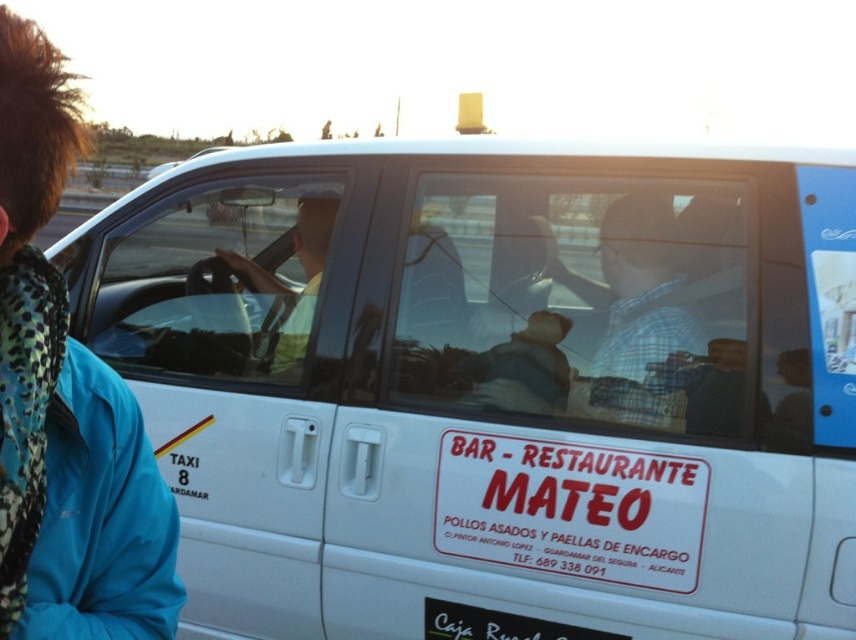
Is white paper sign at center to the right of matte yellow shirt at center from the viewer's perspective?

Yes, white paper sign at center is to the right of matte yellow shirt at center.

Does white paper sign at center appear over matte yellow shirt at center?

Actually, white paper sign at center is below matte yellow shirt at center.

Between point (446, 515) and point (304, 262), which one is positioned in front?

Point (446, 515) is in front.

Identify the location of white paper sign at center. The height and width of the screenshot is (640, 856). (571, 508).

Can you confirm if blue fabric jacket at left is smaller than clear glass steering wheel at center?

Correct, blue fabric jacket at left occupies less space than clear glass steering wheel at center.

Who is higher up, blue fabric jacket at left or clear glass steering wheel at center?

Positioned higher is clear glass steering wheel at center.

The height and width of the screenshot is (640, 856). Find the location of `blue fabric jacket at left`. blue fabric jacket at left is located at coordinates (64, 403).

Find the location of a particular element. The image size is (856, 640). blue fabric jacket at left is located at coordinates (64, 403).

Is point (287, 189) positioned in front of point (623, 544)?

No, it is behind (623, 544).

Is point (277, 205) positioned after point (628, 490)?

Yes, it is.

Identify the location of clear glass steering wheel at center. (218, 280).